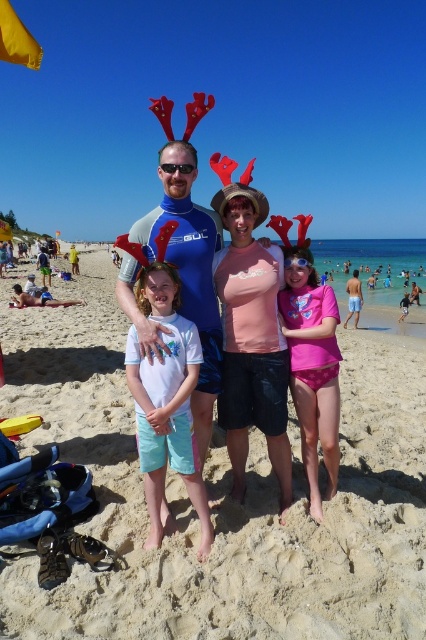
Does blue neoprene wetsuit at center have a smaller size compared to pink polka dot swimsuit at center?

Correct, blue neoprene wetsuit at center occupies less space than pink polka dot swimsuit at center.

Can you confirm if blue neoprene wetsuit at center is taller than pink polka dot swimsuit at center?

In fact, blue neoprene wetsuit at center may be shorter than pink polka dot swimsuit at center.

What do you see at coordinates (189, 269) in the screenshot? The height and width of the screenshot is (640, 426). I see `blue neoprene wetsuit at center` at bounding box center [189, 269].

You are a GUI agent. You are given a task and a screenshot of the screen. Output one action in this format:
    pyautogui.click(x=<x>, y=<y>)
    Task: Click on the blue neoprene wetsuit at center
    This screenshot has height=640, width=426.
    Given the screenshot: What is the action you would take?
    pyautogui.click(x=189, y=269)

You are a GUI agent. You are given a task and a screenshot of the screen. Output one action in this format:
    pyautogui.click(x=<x>, y=<y>)
    Task: Click on the blue neoprene wetsuit at center
    This screenshot has width=426, height=640.
    Given the screenshot: What is the action you would take?
    pyautogui.click(x=189, y=269)

Does point (172, 161) lie behind point (178, 333)?

Yes, it is.

Who is more distant from viewer, (204,307) or (143,433)?

Point (204,307)

Image resolution: width=426 pixels, height=640 pixels. In order to click on blue neoprene wetsuit at center in this screenshot , I will do `click(189, 269)`.

Does beige sandy beach at center lie in front of white matte t-shirt at center?

Yes, beige sandy beach at center is in front of white matte t-shirt at center.

Can you confirm if beige sandy beach at center is positioned below white matte t-shirt at center?

No.

Between point (215, 550) and point (166, 460), which one is positioned in front?

Point (215, 550) is more forward.

This screenshot has width=426, height=640. Identify the location of beige sandy beach at center. (219, 497).